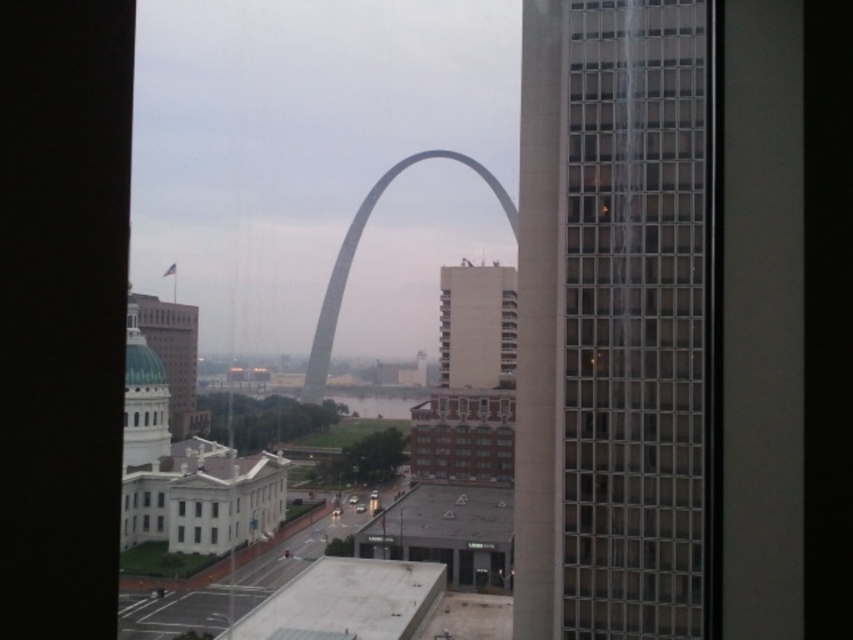
Question: Can you confirm if teal dome building at left is positioned below transparent glass building at center?

Choices:
 (A) yes
 (B) no

Answer: (A)

Question: Considering the relative positions of green dome building at left and transparent glass building at center in the image provided, where is green dome building at left located with respect to transparent glass building at center?

Choices:
 (A) right
 (B) left

Answer: (B)

Question: Which point is farther from the camera taking this photo?

Choices:
 (A) (468, 326)
 (B) (621, 72)

Answer: (A)

Question: Considering the relative positions of gray metallic arch at center and transparent glass building at center in the image provided, where is gray metallic arch at center located with respect to transparent glass building at center?

Choices:
 (A) right
 (B) left

Answer: (B)

Question: Which of the following is the closest to the observer?

Choices:
 (A) glassy steel skyscraper at right
 (B) green dome building at left
 (C) transparent glass window at center
 (D) transparent glass building at center

Answer: (A)

Question: Considering the real-world distances, which object is farthest from the clear glass windows at center?

Choices:
 (A) white concrete building at center
 (B) transparent glass building at center

Answer: (B)